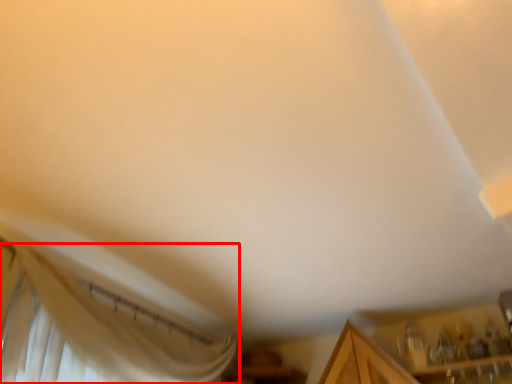
Question: From the image, what is the correct spatial relationship of curtain (annotated by the red box) in relation to cabinetry?

Choices:
 (A) left
 (B) right

Answer: (A)